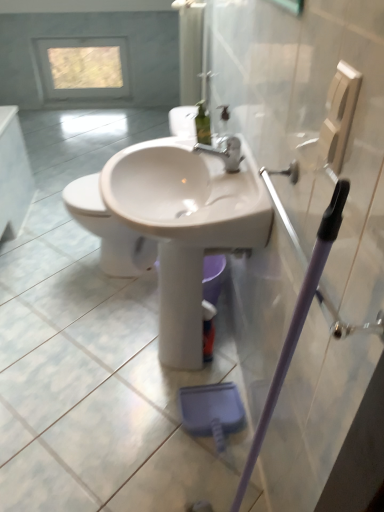
Question: From the image's perspective, does white glossy toilet at center appear lower than transparent glass window at upper center?

Choices:
 (A) yes
 (B) no

Answer: (A)

Question: From the image's perspective, does white glossy toilet at center appear higher than transparent glass window at upper center?

Choices:
 (A) no
 (B) yes

Answer: (A)

Question: Considering the relative positions of white glossy toilet at center and transparent glass window at upper center in the image provided, is white glossy toilet at center behind transparent glass window at upper center?

Choices:
 (A) no
 (B) yes

Answer: (A)

Question: Is white glossy toilet at center turned away from transparent glass window at upper center?

Choices:
 (A) no
 (B) yes

Answer: (A)

Question: Is white glossy toilet at center to the right of transparent glass window at upper center from the viewer's perspective?

Choices:
 (A) yes
 (B) no

Answer: (A)

Question: Is transparent plastic screen door at upper right taller or shorter than white glossy toilet at center?

Choices:
 (A) tall
 (B) short

Answer: (A)

Question: Considering the positions of point (322, 366) and point (97, 232), is point (322, 366) closer or farther from the camera than point (97, 232)?

Choices:
 (A) closer
 (B) farther

Answer: (A)

Question: Choose the correct answer: Is transparent plastic screen door at upper right inside white glossy toilet at center or outside it?

Choices:
 (A) outside
 (B) inside

Answer: (A)

Question: From a real-world perspective, relative to white glossy toilet at center, is transparent plastic screen door at upper right vertically above or below?

Choices:
 (A) below
 (B) above

Answer: (B)

Question: Considering their positions, is white glossy toilet at center located in front of or behind transparent plastic screen door at upper right?

Choices:
 (A) front
 (B) behind

Answer: (B)

Question: In terms of height, does white glossy toilet at center look taller or shorter compared to transparent plastic screen door at upper right?

Choices:
 (A) tall
 (B) short

Answer: (B)

Question: In terms of width, does white glossy toilet at center look wider or thinner when compared to transparent plastic screen door at upper right?

Choices:
 (A) thin
 (B) wide

Answer: (B)

Question: Do you think white glossy toilet at center is within transparent plastic screen door at upper right, or outside of it?

Choices:
 (A) inside
 (B) outside

Answer: (B)

Question: Is white glossy sink at center wider or thinner than transparent glass window at upper center?

Choices:
 (A) wide
 (B) thin

Answer: (A)

Question: Is white glossy sink at center taller or shorter than transparent glass window at upper center?

Choices:
 (A) tall
 (B) short

Answer: (A)